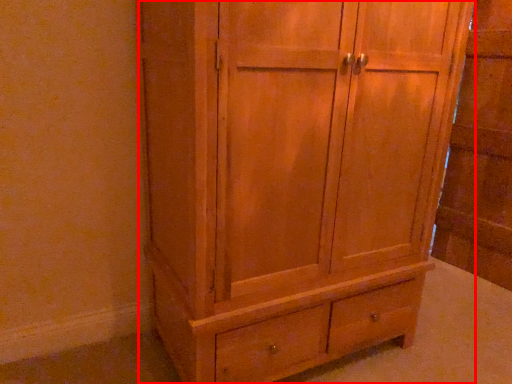
Question: Observing the image, what is the correct spatial positioning of cupboard (annotated by the red box) in reference to side cabinet?

Choices:
 (A) right
 (B) left

Answer: (B)